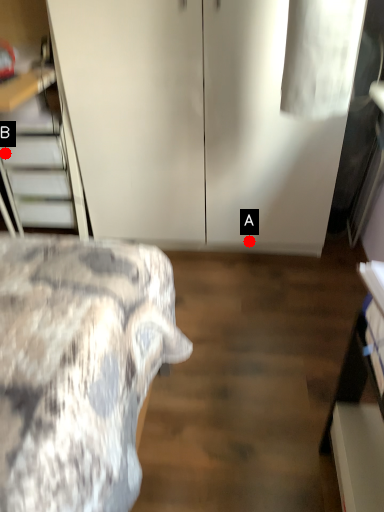
Question: Two points are circled on the image, labeled by A and B beside each circle. Which of the following is the farthest from the observer?

Choices:
 (A) A is further
 (B) B is further

Answer: (A)